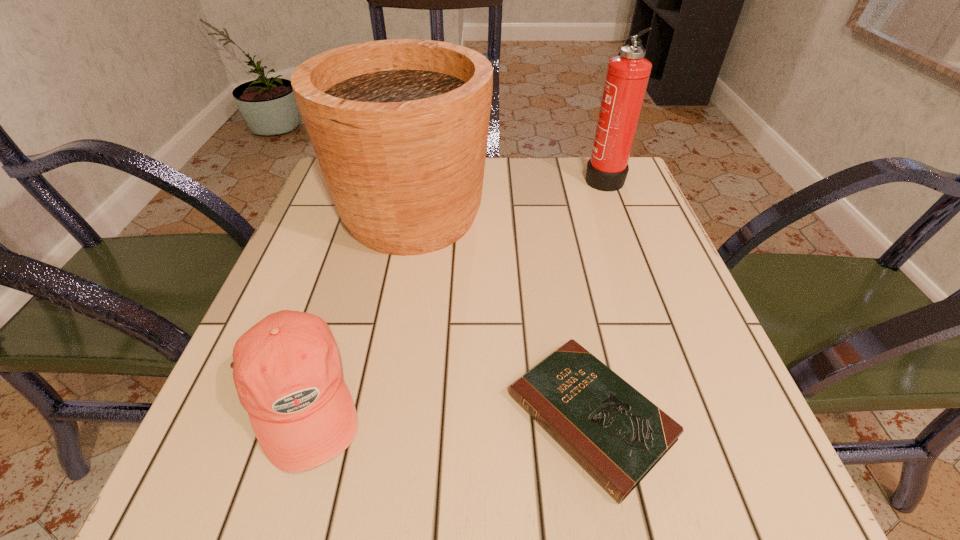
Where is `free space that satisfies the following two spatial constraints: 1. on the front-facing side of the fire extinguisher; 2. on the front side of the Bible`? The width and height of the screenshot is (960, 540). free space that satisfies the following two spatial constraints: 1. on the front-facing side of the fire extinguisher; 2. on the front side of the Bible is located at coordinates (693, 417).

This screenshot has height=540, width=960. Identify the location of vacant area that satisfies the following two spatial constraints: 1. on the front side of the flowerpot; 2. on the right side of the shortest object. (375, 417).

In order to click on free location that satisfies the following two spatial constraints: 1. on the front side of the flowerpot; 2. on the right side of the shortest object in this screenshot , I will do `click(375, 417)`.